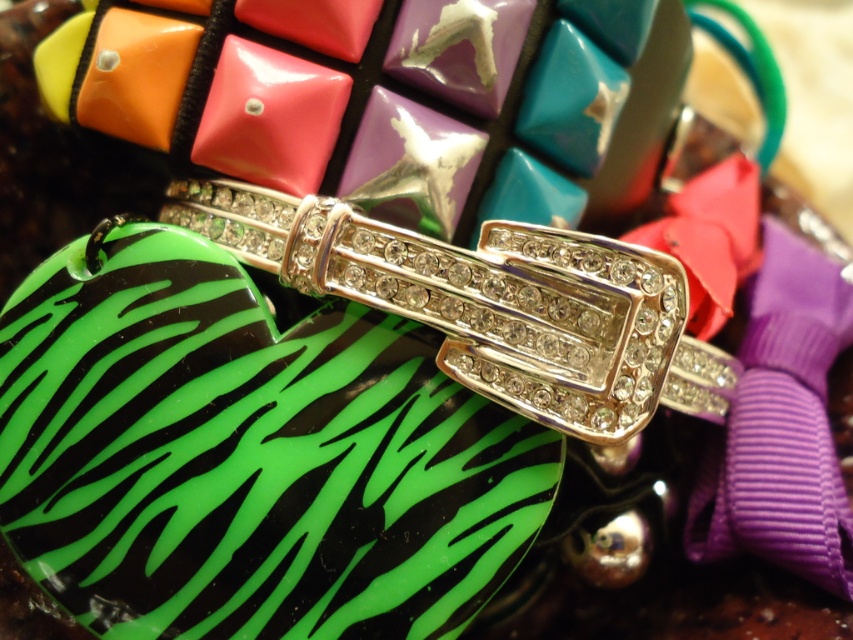
Question: From the image, what is the correct spatial relationship of gold plated rhinestone ring at center in relation to matte pink ribbon at center?

Choices:
 (A) below
 (B) above

Answer: (A)

Question: Among these objects, which one is farthest from the camera?

Choices:
 (A) gold plated rhinestone ring at center
 (B) matte pink ribbon at center

Answer: (B)

Question: Can you confirm if gold plated rhinestone ring at center is positioned to the left of matte pink ribbon at center?

Choices:
 (A) no
 (B) yes

Answer: (B)

Question: Is gold plated rhinestone ring at center bigger than matte pink ribbon at center?

Choices:
 (A) yes
 (B) no

Answer: (B)

Question: Which point appears closest to the camera in this image?

Choices:
 (A) (706, 296)
 (B) (654, 396)

Answer: (B)

Question: Which point is farther to the camera?

Choices:
 (A) matte pink ribbon at center
 (B) gold plated rhinestone ring at center

Answer: (A)